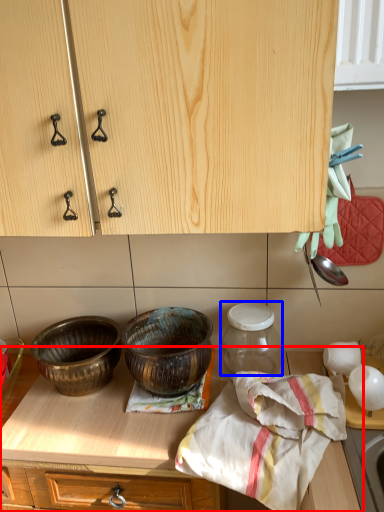
Question: Which object appears closest to the camera in this image, countertop (highlighted by a red box) or glass jar (highlighted by a blue box)?

Choices:
 (A) countertop
 (B) glass jar

Answer: (A)